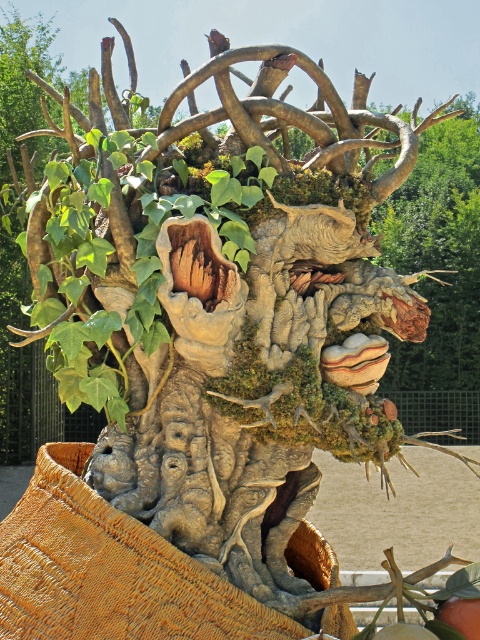
What do you see at coordinates (109, 572) in the screenshot? This screenshot has height=640, width=480. I see `leather textured basket at lower left` at bounding box center [109, 572].

Does leather textured basket at lower left appear under green matte fruit at center?

Actually, leather textured basket at lower left is above green matte fruit at center.

Is point (40, 486) closer to camera compared to point (470, 634)?

No.

Where is `leather textured basket at lower left`? leather textured basket at lower left is located at coordinates (109, 572).

Is green matte fruit at center shorter than green matte fruit at lower center?

Indeed, green matte fruit at center has a lesser height compared to green matte fruit at lower center.

At what (x,y) coordinates should I click in order to perform the action: click on green matte fruit at center. Please return your answer as a coordinate pair (x, y). Looking at the image, I should click on (462, 616).

What are the coordinates of `green matte fruit at center` in the screenshot? It's located at (462, 616).

Locate an element on the screen. green matte fruit at center is located at coordinates (462, 616).

Can you confirm if leather textured basket at lower left is positioned to the left of green matte fruit at lower center?

Yes, leather textured basket at lower left is to the left of green matte fruit at lower center.

This screenshot has height=640, width=480. What are the coordinates of `leather textured basket at lower left` in the screenshot? It's located at (109, 572).